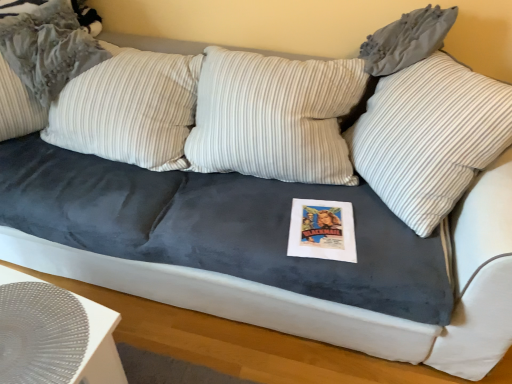
The image size is (512, 384). Describe the element at coordinates (429, 137) in the screenshot. I see `white striped pillow at upper center, the 1th pillow when ordered from right to left` at that location.

What is the approximate height of white striped pillow at upper center, the 1th pillow when ordered from right to left?

white striped pillow at upper center, the 1th pillow when ordered from right to left, is 31.13 inches tall.

Locate an element on the screen. This screenshot has width=512, height=384. white textured placemat at lower left is located at coordinates (54, 335).

The height and width of the screenshot is (384, 512). I want to click on striped fabric pillow at upper left, the 2th pillow from the right, so click(x=48, y=48).

Locate an element on the screen. white striped pillow at upper center, the 1th pillow when ordered from right to left is located at coordinates (429, 137).

Can you confirm if white striped pillow at upper center, the second pillow when ordered from left to right, is bigger than white textured placemat at lower left?

Yes, white striped pillow at upper center, the second pillow when ordered from left to right, is bigger than white textured placemat at lower left.

Where is `the 1st pillow behind the white textured placemat at lower left`? This screenshot has width=512, height=384. the 1st pillow behind the white textured placemat at lower left is located at coordinates click(429, 137).

Is white striped pillow at upper center, the second pillow when ordered from left to right, outside of white textured placemat at lower left?

Absolutely, white striped pillow at upper center, the second pillow when ordered from left to right, is external to white textured placemat at lower left.

From a real-world perspective, is white striped pillow at upper center, the second pillow when ordered from left to right, physically located above or below white textured placemat at lower left?

From a real-world perspective, white striped pillow at upper center, the second pillow when ordered from left to right, is physically above white textured placemat at lower left.

Between striped fabric pillow at upper left, which is the 1th pillow in left-to-right order, and white striped pillow at upper center, the second pillow when ordered from left to right, which one has more height?

white striped pillow at upper center, the second pillow when ordered from left to right.

Considering the relative positions of striped fabric pillow at upper left, the 2th pillow from the right, and white striped pillow at upper center, the second pillow when ordered from left to right, in the image provided, is striped fabric pillow at upper left, the 2th pillow from the right, in front of white striped pillow at upper center, the second pillow when ordered from left to right,?

No, striped fabric pillow at upper left, the 2th pillow from the right, is behind white striped pillow at upper center, the second pillow when ordered from left to right.

Consider the image. Between striped fabric pillow at upper left, the 2th pillow from the right, and white striped pillow at upper center, the second pillow when ordered from left to right, which one has smaller width?

Thinner between the two is striped fabric pillow at upper left, the 2th pillow from the right.

Can you confirm if striped fabric pillow at upper left, the 2th pillow from the right, is positioned to the left of white striped pillow at upper center, the second pillow when ordered from left to right?

Indeed, striped fabric pillow at upper left, the 2th pillow from the right, is positioned on the left side of white striped pillow at upper center, the second pillow when ordered from left to right.

Can you confirm if striped fabric pillow at upper left, the 2th pillow from the right, is positioned to the right of white textured placemat at lower left?

In fact, striped fabric pillow at upper left, the 2th pillow from the right, is to the left of white textured placemat at lower left.

How different are the orientations of striped fabric pillow at upper left, the 2th pillow from the right, and white textured placemat at lower left in degrees?

striped fabric pillow at upper left, the 2th pillow from the right, and white textured placemat at lower left are facing 52.8 degrees away from each other.

Does striped fabric pillow at upper left, which is the 1th pillow in left-to-right order, turn towards white textured placemat at lower left?

Yes, striped fabric pillow at upper left, which is the 1th pillow in left-to-right order, faces towards white textured placemat at lower left.

Consider the image. Is striped fabric pillow at upper left, the 2th pillow from the right, situated inside white textured placemat at lower left or outside?

striped fabric pillow at upper left, the 2th pillow from the right, exists outside the volume of white textured placemat at lower left.

Can you confirm if white textured placemat at lower left is positioned to the left of white striped pillow at upper center, the 1th pillow when ordered from right to left?

Indeed, white textured placemat at lower left is positioned on the left side of white striped pillow at upper center, the 1th pillow when ordered from right to left.

From the picture: Is white textured placemat at lower left next to white striped pillow at upper center, the second pillow when ordered from left to right, and touching it?

There is a gap between white textured placemat at lower left and white striped pillow at upper center, the second pillow when ordered from left to right.

Does white textured placemat at lower left have a greater height compared to white striped pillow at upper center, the second pillow when ordered from left to right?

No.

Is white textured placemat at lower left completely or partially outside of white striped pillow at upper center, the second pillow when ordered from left to right?

Yes, white textured placemat at lower left is not within white striped pillow at upper center, the second pillow when ordered from left to right.

Is white striped pillow at upper center, the second pillow when ordered from left to right, positioned with its back to striped fabric pillow at upper left, the 2th pillow from the right?

white striped pillow at upper center, the second pillow when ordered from left to right, is not turned away from striped fabric pillow at upper left, the 2th pillow from the right.

What are the coordinates of `pillow below the striped fabric pillow at upper left, which is the 1th pillow in left-to-right order (from the image's perspective)` in the screenshot? It's located at (429, 137).

In terms of width, does white striped pillow at upper center, the 1th pillow when ordered from right to left, look wider or thinner when compared to striped fabric pillow at upper left, the 2th pillow from the right?

Clearly, white striped pillow at upper center, the 1th pillow when ordered from right to left, has more width compared to striped fabric pillow at upper left, the 2th pillow from the right.

How far apart are white striped pillow at upper center, the 1th pillow when ordered from right to left, and striped fabric pillow at upper left, which is the 1th pillow in left-to-right order?

white striped pillow at upper center, the 1th pillow when ordered from right to left, is 4.10 feet away from striped fabric pillow at upper left, which is the 1th pillow in left-to-right order.

Can you tell me how much white textured placemat at lower left and striped fabric pillow at upper left, which is the 1th pillow in left-to-right order, differ in facing direction?

52.8 degrees.

Is striped fabric pillow at upper left, which is the 1th pillow in left-to-right order, inside white textured placemat at lower left?

No, striped fabric pillow at upper left, which is the 1th pillow in left-to-right order, is not a part of white textured placemat at lower left.

This screenshot has height=384, width=512. I want to click on the 2nd pillow above the white textured placemat at lower left (from the image's perspective), so click(x=48, y=48).

From a real-world perspective, is white textured placemat at lower left positioned above or below striped fabric pillow at upper left, the 2th pillow from the right?

In terms of real-world spatial position, white textured placemat at lower left is below striped fabric pillow at upper left, the 2th pillow from the right.

Locate an element on the screen. This screenshot has width=512, height=384. the 1st pillow behind the white textured placemat at lower left, starting your count from the anchor is located at coordinates (429, 137).

Identify the location of pillow located above the white striped pillow at upper center, the 1th pillow when ordered from right to left (from the image's perspective). This screenshot has height=384, width=512. (48, 48).

When comparing their distances from white textured placemat at lower left, does white striped pillow at upper center, the second pillow when ordered from left to right, or striped fabric pillow at upper left, which is the 1th pillow in left-to-right order, seem further?

white striped pillow at upper center, the second pillow when ordered from left to right.

Which object lies further to the anchor point white striped pillow at upper center, the 1th pillow when ordered from right to left, striped fabric pillow at upper left, the 2th pillow from the right, or white textured placemat at lower left?

striped fabric pillow at upper left, the 2th pillow from the right, is positioned further to the anchor white striped pillow at upper center, the 1th pillow when ordered from right to left.

Looking at this image, from the image, which object appears to be farther from striped fabric pillow at upper left, the 2th pillow from the right, white striped pillow at upper center, the 1th pillow when ordered from right to left, or white textured placemat at lower left?

white striped pillow at upper center, the 1th pillow when ordered from right to left, is positioned further to the anchor striped fabric pillow at upper left, the 2th pillow from the right.

From the image, which object appears to be farther from white textured placemat at lower left, striped fabric pillow at upper left, the 2th pillow from the right, or white striped pillow at upper center, the second pillow when ordered from left to right?

The object further to white textured placemat at lower left is white striped pillow at upper center, the second pillow when ordered from left to right.

Which object lies further to the anchor point white striped pillow at upper center, the 1th pillow when ordered from right to left, white textured placemat at lower left or striped fabric pillow at upper left, which is the 1th pillow in left-to-right order?

striped fabric pillow at upper left, which is the 1th pillow in left-to-right order, is positioned further to the anchor white striped pillow at upper center, the 1th pillow when ordered from right to left.

Estimate the real-world distances between objects in this image. Which object is further from striped fabric pillow at upper left, the 2th pillow from the right, white textured placemat at lower left or white striped pillow at upper center, the second pillow when ordered from left to right?

Based on the image, white striped pillow at upper center, the second pillow when ordered from left to right, appears to be further to striped fabric pillow at upper left, the 2th pillow from the right.

The image size is (512, 384). What are the coordinates of `table situated between striped fabric pillow at upper left, which is the 1th pillow in left-to-right order, and white striped pillow at upper center, the 1th pillow when ordered from right to left, from left to right` in the screenshot? It's located at (54, 335).